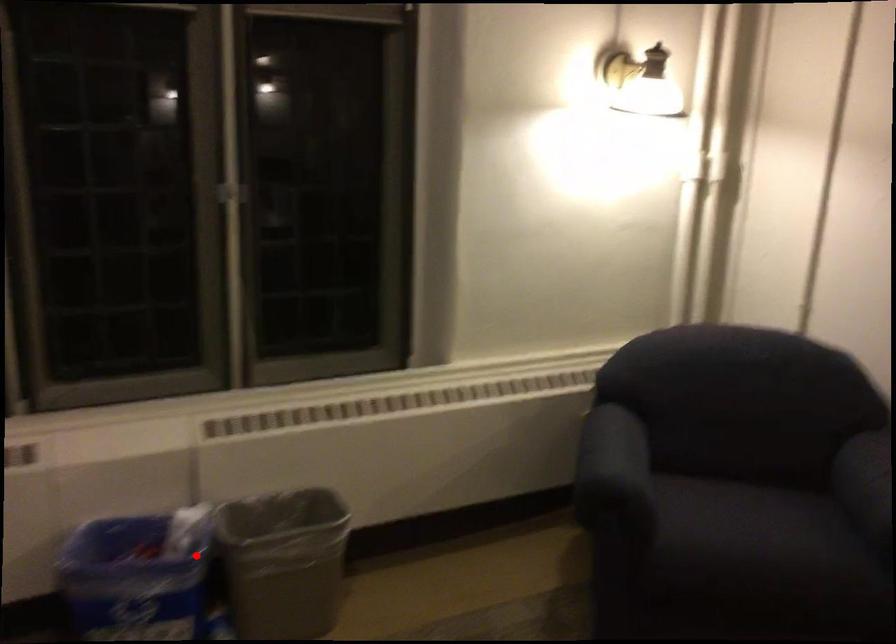
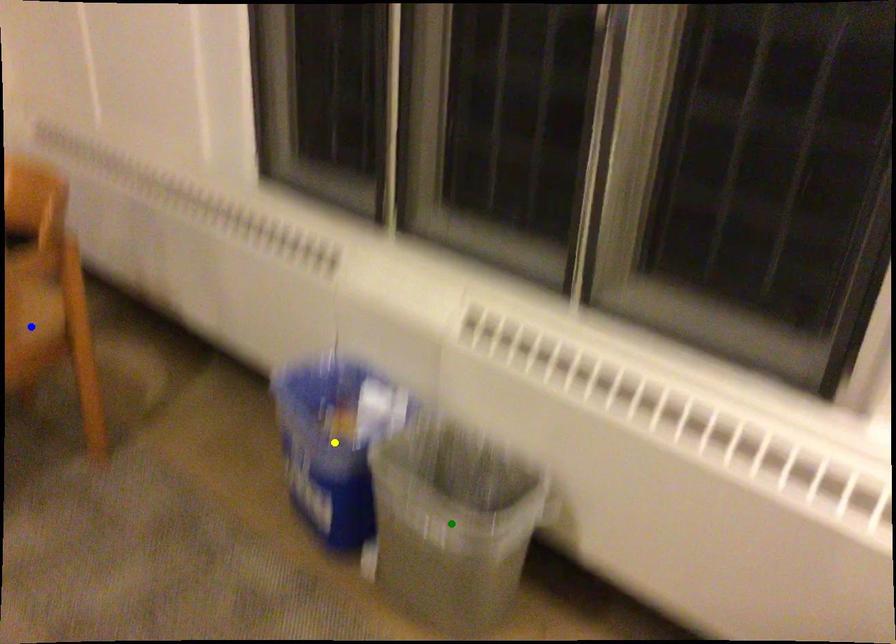
Question: I am providing you with two images of the same scene from different viewpoints. A red point is marked on the first image. You are given multiple points on the second image. Which point in image 2 is actually the same real-world point as the red point in image 1?

Choices:
 (A) blue point
 (B) green point
 (C) yellow point

Answer: (C)